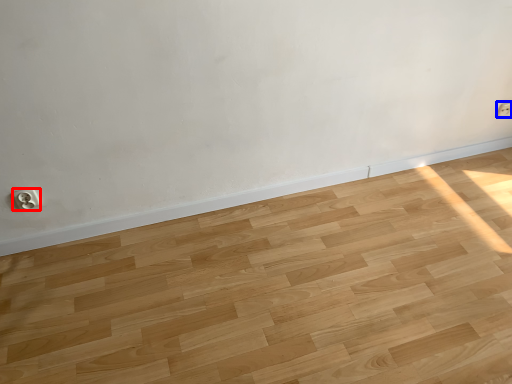
Question: Which of the following is the closest to the observer, electric outlet (highlighted by a red box) or electric outlet (highlighted by a blue box)?

Choices:
 (A) electric outlet
 (B) electric outlet

Answer: (A)